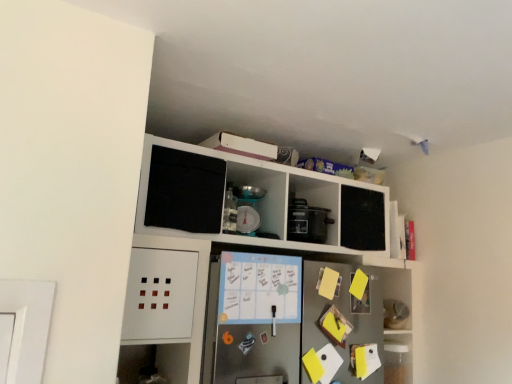
The height and width of the screenshot is (384, 512). What are the coordinates of `white matte cabinet at upper center` in the screenshot? It's located at (260, 274).

What is the approximate height of matte black rice cooker at center?

The height of matte black rice cooker at center is 7.57 inches.

What is the approximate width of metallic scale at upper center?

It is 7.10 inches.

Locate an element on the screen. white matte cabinet at upper center is located at coordinates click(x=260, y=274).

Is metallic scale at upper center at the back of white matte cabinet at upper center?

That's right, white matte cabinet at upper center is facing away from metallic scale at upper center.

Between white matte cabinet at upper center and metallic scale at upper center, which one appears on the left side from the viewer's perspective?

metallic scale at upper center.

From the image's perspective, is white matte cabinet at upper center below metallic scale at upper center?

Correct, white matte cabinet at upper center appears lower than metallic scale at upper center in the image.

Does white matte cabinet at upper center touch metallic scale at upper center?

white matte cabinet at upper center and metallic scale at upper center are clearly separated.

Is metallic scale at upper center positioned beyond the bounds of white matte cabinet at upper center?

No, metallic scale at upper center is inside or overlapping with white matte cabinet at upper center.

Considering the sizes of objects metallic scale at upper center and white matte cabinet at upper center in the image provided, who is thinner, metallic scale at upper center or white matte cabinet at upper center?

Thinner between the two is metallic scale at upper center.

Is metallic scale at upper center positioned with its back to white matte cabinet at upper center?

Correct, metallic scale at upper center is looking away from white matte cabinet at upper center.

Does metallic scale at upper center have a smaller size compared to white matte cabinet at upper center?

Correct, metallic scale at upper center occupies less space than white matte cabinet at upper center.

Between white matte cabinet at upper center and matte black rice cooker at center, which one has larger size?

Bigger between the two is white matte cabinet at upper center.

In the image, is white matte cabinet at upper center positioned in front of or behind matte black rice cooker at center?

Clearly, white matte cabinet at upper center is in front of matte black rice cooker at center.

Consider the image. Visually, is white matte cabinet at upper center positioned to the left or to the right of matte black rice cooker at center?

From the image, it's evident that white matte cabinet at upper center is to the left of matte black rice cooker at center.

I want to click on cabinetry on the left of matte black rice cooker at center, so click(x=260, y=274).

Looking at the image, does metallic scale at upper center seem bigger or smaller compared to matte black rice cooker at center?

metallic scale at upper center is smaller than matte black rice cooker at center.

Can you confirm if metallic scale at upper center is shorter than matte black rice cooker at center?

No.

Based on their positions, is metallic scale at upper center located to the left or right of matte black rice cooker at center?

metallic scale at upper center is positioned on matte black rice cooker at center's left side.

Looking at this image, in terms of width, does metallic scale at upper center look wider or thinner when compared to matte black rice cooker at center?

Considering their sizes, metallic scale at upper center looks slimmer than matte black rice cooker at center.

Does matte black rice cooker at center have a larger size compared to white matte cabinet at upper center?

No.

In the scene shown: Considering the relative positions of matte black rice cooker at center and white matte cabinet at upper center in the image provided, is matte black rice cooker at center to the left or to the right of white matte cabinet at upper center?

matte black rice cooker at center is positioned on white matte cabinet at upper center's right side.

Find the location of `cabinetry on the left of matte black rice cooker at center`. cabinetry on the left of matte black rice cooker at center is located at coordinates (260, 274).

Is matte black rice cooker at center aimed at white matte cabinet at upper center?

Yes, matte black rice cooker at center faces towards white matte cabinet at upper center.

Consider the image. Is matte black rice cooker at center outside of metallic scale at upper center?

That's correct, matte black rice cooker at center is outside of metallic scale at upper center.

Considering the relative positions of matte black rice cooker at center and metallic scale at upper center in the image provided, is matte black rice cooker at center to the left of metallic scale at upper center from the viewer's perspective?

No, matte black rice cooker at center is not to the left of metallic scale at upper center.

Where is `appliance on the right side of metallic scale at upper center`? The width and height of the screenshot is (512, 384). appliance on the right side of metallic scale at upper center is located at coordinates click(307, 222).

Locate an element on the screen. cabinet above the white matte cabinet at upper center (from the image's perspective) is located at coordinates (263, 195).

At what (x,y) coordinates should I click in order to perform the action: click on cabinet that is on the left side of white matte cabinet at upper center. Please return your answer as a coordinate pair (x, y). Image resolution: width=512 pixels, height=384 pixels. Looking at the image, I should click on (263, 195).

Looking at the image, which one is located further to white matte cabinet at upper center, matte black rice cooker at center or metallic scale at upper center?

matte black rice cooker at center is further to white matte cabinet at upper center.

When comparing their distances from white matte cabinet at upper center, does metallic scale at upper center or matte black rice cooker at center seem closer?

metallic scale at upper center is positioned closer to the anchor white matte cabinet at upper center.

Considering their positions, is white matte cabinet at upper center positioned closer to metallic scale at upper center than matte black rice cooker at center?

matte black rice cooker at center lies closer to metallic scale at upper center than the other object.

Which object lies nearer to the anchor point matte black rice cooker at center, metallic scale at upper center or white matte cabinet at upper center?

Based on the image, metallic scale at upper center appears to be nearer to matte black rice cooker at center.

From the image, which object appears to be nearer to metallic scale at upper center, matte black rice cooker at center or white matte cabinet at upper center?

Among the two, matte black rice cooker at center is located nearer to metallic scale at upper center.

Based on their spatial positions, is white matte cabinet at upper center or metallic scale at upper center closer to matte black rice cooker at center?

The object closer to matte black rice cooker at center is metallic scale at upper center.

The width and height of the screenshot is (512, 384). Identify the location of cabinet between white matte cabinet at upper center and matte black rice cooker at center from front to back. (263, 195).